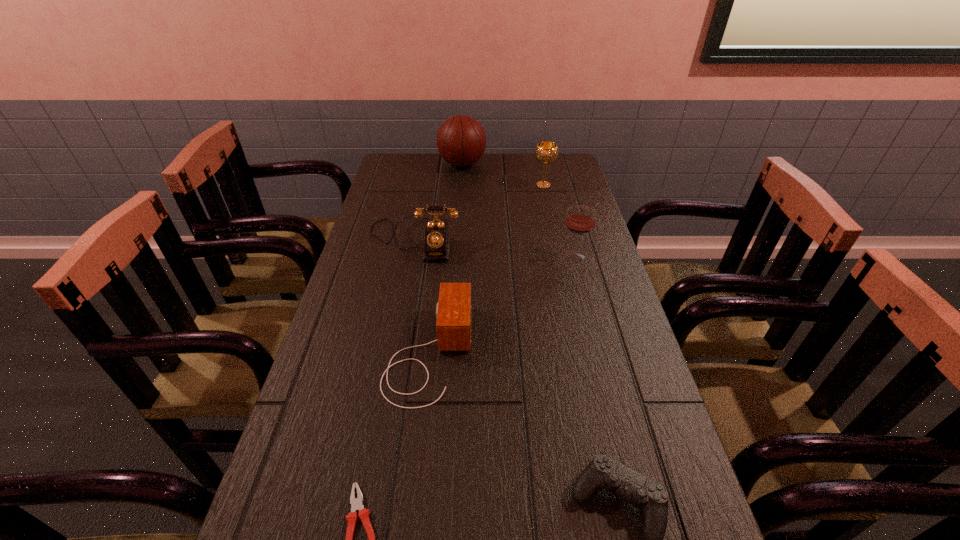
Find the location of `free space located 0.230m on the dial of the telephone`. free space located 0.230m on the dial of the telephone is located at coordinates (398, 320).

Locate an element on the screen. The image size is (960, 540). vacant region located 0.360m on the front-facing side of the radio receiver is located at coordinates click(x=626, y=353).

Locate an element on the screen. The image size is (960, 540). basketball that is at the far edge is located at coordinates (461, 141).

The height and width of the screenshot is (540, 960). What are the coordinates of `chalice positioned at the far edge` in the screenshot? It's located at (546, 152).

The height and width of the screenshot is (540, 960). I want to click on telephone present at the left edge, so click(x=436, y=238).

In order to click on radio receiver present at the left edge in this screenshot , I will do `click(453, 311)`.

Where is `chalice at the right edge`? The height and width of the screenshot is (540, 960). chalice at the right edge is located at coordinates (546, 152).

Identify the location of wineglass that is at the right edge. The width and height of the screenshot is (960, 540). (580, 220).

Where is `object that is at the far right corner`? object that is at the far right corner is located at coordinates (546, 152).

In the image, there is a desktop. Identify the location of vacant space at the far edge. The height and width of the screenshot is (540, 960). (530, 155).